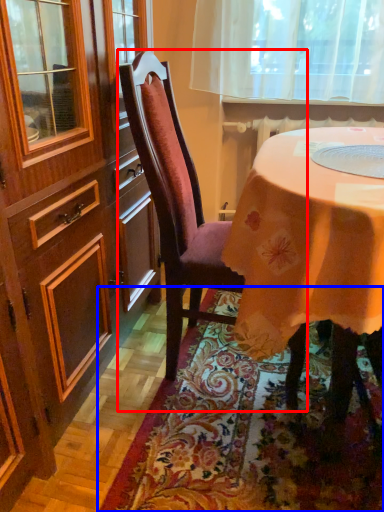
Question: Among these objects, which one is farthest to the camera, chair (highlighted by a red box) or mat (highlighted by a blue box)?

Choices:
 (A) chair
 (B) mat

Answer: (A)